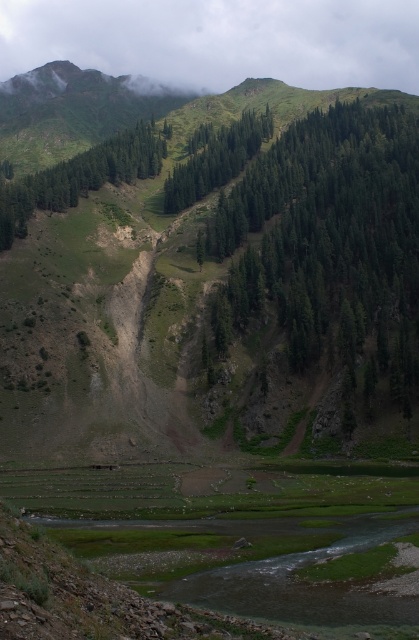
You are an environmental scientist assessing the biodiversity of this mountain landscape. You observe the green textured trees at upper center and the green matte tree at upper left. Which of these two trees has a greater width, and what might this indicate about their ecological roles?

The green textured trees at upper center have a greater width than the green matte tree at upper left. This could suggest that the wider trees are more established or dominant in the ecosystem, potentially providing more shade, habitat, or resources compared to the narrower tree.

You are a hiker planning to reach the cloudy green at upper center from the green matte tree at center. Based on the scene, which direction should you head towards?

The cloudy green at upper center is above the green matte tree at center, so you should head upwards to reach it.

Looking at this image, you are an environmental scientist assessing the landscape. You observe the cloudy green at upper center and the green matte tree at center. Which of these two features has a greater width in the image?

The cloudy green at upper center has a greater width than the green matte tree at center according to the description.